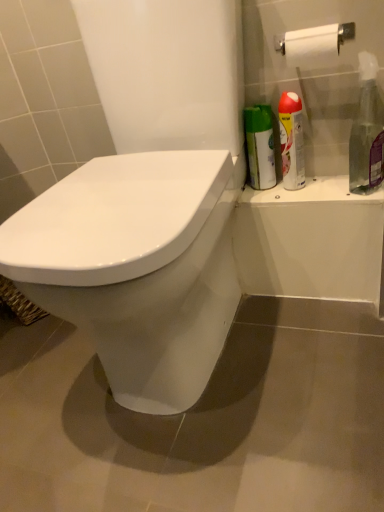
At what (x,y) coordinates should I click in order to perform the action: click on free space in front of white glossy toilet at center. Please return your answer as a coordinate pair (x, y). This screenshot has width=384, height=512. Looking at the image, I should click on (233, 453).